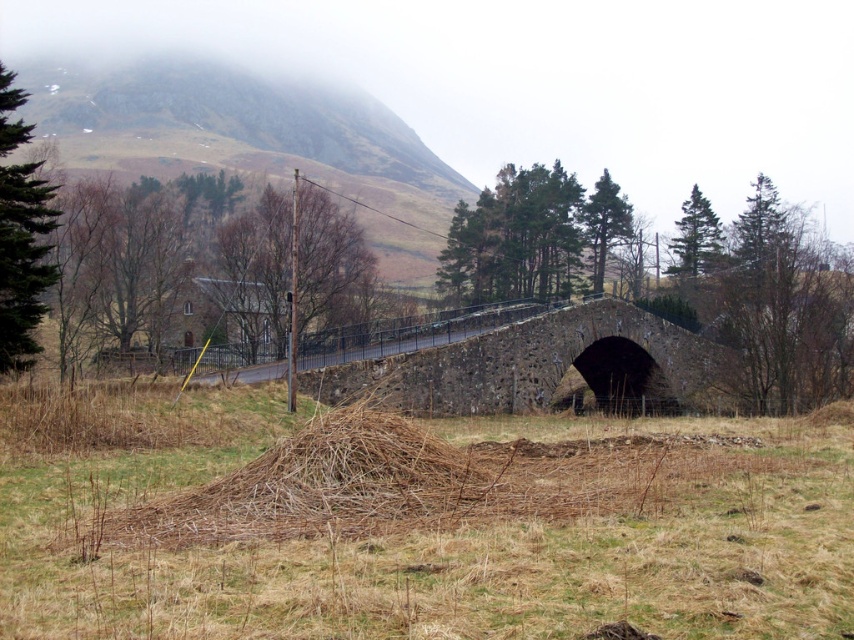
You are a farmer checking the condition of your fields. You notice the brown dry grass at lower center and the stone bridge at center. Which object is narrower in width?

The brown dry grass at lower center is thinner than the stone bridge at center, so the brown dry grass at lower center is narrower in width.

You are standing at the center of the stone bridge and want to find the brown dry grass at lower center. In which direction should you look to see it?

The brown dry grass at lower center is located at the lower center of the image, so you should look downward and towards the center of the bridge to see it.

You are a hiker standing at the edge of the field. You see the brown dry grass at lower center and the stone bridge at center. Which object is closer to you?

The brown dry grass at lower center is closer to you because it is in front of the stone bridge at center.